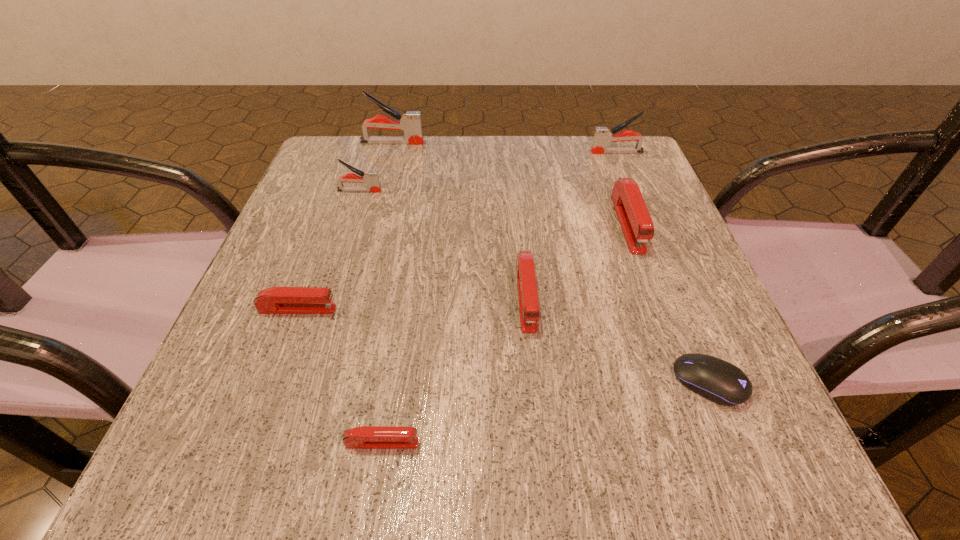
Identify the location of the tallest object. This screenshot has height=540, width=960. (410, 123).

I want to click on the farthest stapler, so click(x=410, y=123).

Identify the location of the second tallest object. pos(602,136).

The image size is (960, 540). What are the coordinates of `the sixth shortest stapler` in the screenshot? It's located at coord(602,136).

Identify the location of the third farthest stapler. The width and height of the screenshot is (960, 540). (371, 178).

Where is `the nearest gray stapler`? The width and height of the screenshot is (960, 540). the nearest gray stapler is located at coordinates (371, 178).

Find the location of `the farthest red stapler`. the farthest red stapler is located at coordinates (637, 226).

This screenshot has height=540, width=960. I want to click on the rightmost red stapler, so click(x=637, y=226).

Identify the location of the fifth tallest object. (528, 301).

Identify the location of the second red stapler from right to left. The height and width of the screenshot is (540, 960). (528, 301).